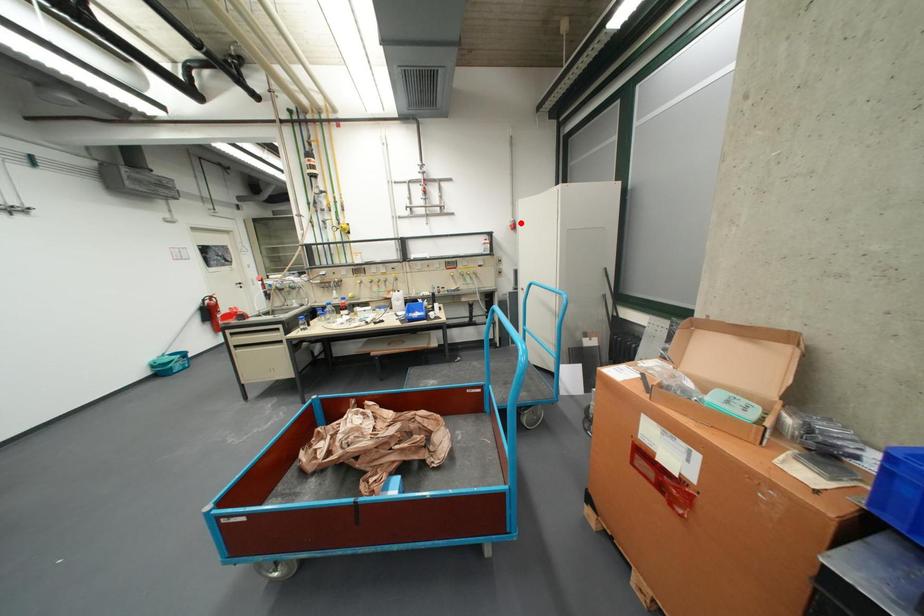
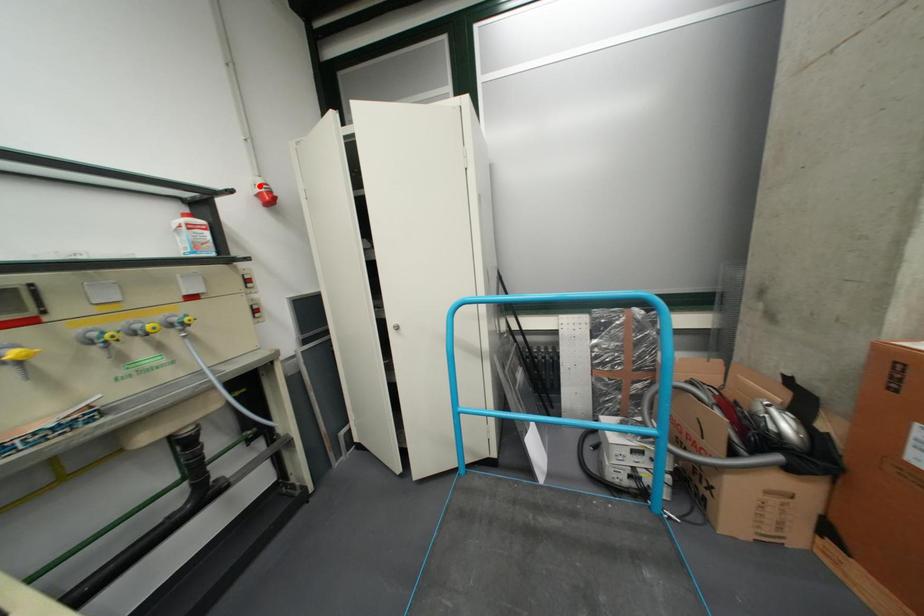
I am providing you with two images of the same scene from different viewpoints. A red point is marked on the first image and another point is marked on the second image. Is the marked point in image1 the same physical position as the marked point in image2?

Yes